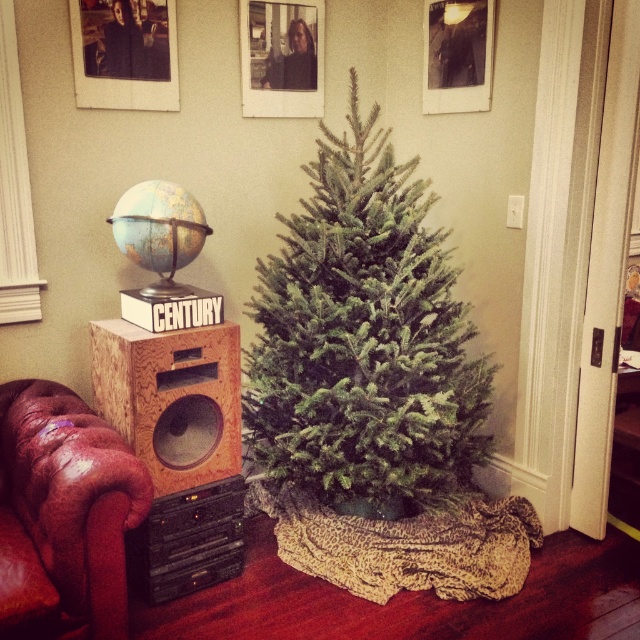
You are planning to place a new decorative item between the green natural fir tree at center and the leather at left. Based on their sizes, which object should you place the item closer to to ensure it fits better?

The green natural fir tree at center is wider than the leather at left, so placing the decorative item closer to the green natural fir tree at center would allow it to fit better due to its larger width.

You are organizing a small Christmas party and need to place a decorative item on the surface that is currently occupied by the leather at left and wooden speaker at left. Which object should you move to make space?

You should move the leather at left to make space because it is located below the wooden speaker at left, so removing it would free up the lower area without disturbing the speaker.

You are planning to place a new decorative item between the green natural fir tree at center and the wooden speaker at left. Considering their sizes, which object should you place the item closer to to ensure it doesn

The green natural fir tree at center is wider than the wooden speaker at left, so placing the decorative item closer to the tree would allow it to be more visible and balanced in the arrangement.